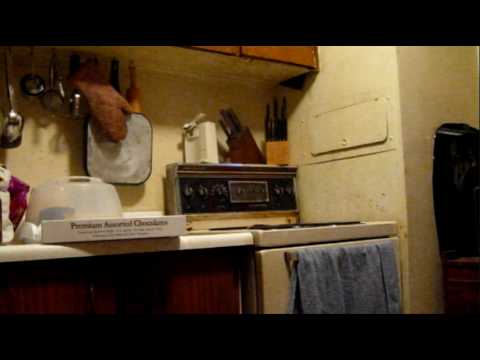
Find the location of a particular element. knives is located at coordinates (237, 128), (228, 118), (274, 125), (282, 128).